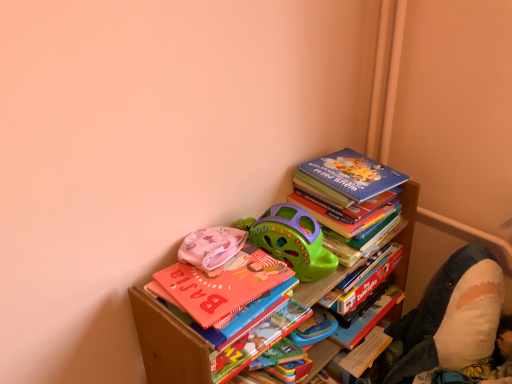
Question: Is green plastic toy car at upper center, positioned as the 2th toy in left-to-right order, behind multicolored paper at center, marked as the 2th paperback book in a right-to-left arrangement?

Choices:
 (A) yes
 (B) no

Answer: (B)

Question: Can you confirm if green plastic toy car at upper center, which is the second toy from right to left, is thinner than multicolored paper at center, acting as the second paperback book starting from the top?

Choices:
 (A) no
 (B) yes

Answer: (A)

Question: Is green plastic toy car at upper center, which is the second toy from right to left, directly adjacent to multicolored paper at center, acting as the second paperback book starting from the top?

Choices:
 (A) no
 (B) yes

Answer: (A)

Question: Can you confirm if green plastic toy car at upper center, positioned as the 2th toy in left-to-right order, is positioned to the left of multicolored paper at center, acting as the second paperback book starting from the top?

Choices:
 (A) no
 (B) yes

Answer: (A)

Question: Does green plastic toy car at upper center, which is the second toy from right to left, have a lesser height compared to multicolored paper at center, the first paperback book in the bottom-to-top sequence?

Choices:
 (A) yes
 (B) no

Answer: (B)

Question: Is blue matte book at upper right in front of or behind green plastic toy car at upper center, positioned as the 2th toy in left-to-right order, in the image?

Choices:
 (A) behind
 (B) front

Answer: (A)

Question: Visually, is blue matte book at upper right positioned to the left or to the right of green plastic toy car at upper center, which is the second toy from right to left?

Choices:
 (A) left
 (B) right

Answer: (B)

Question: Considering the positions of point (326, 155) and point (306, 279), is point (326, 155) closer or farther from the camera than point (306, 279)?

Choices:
 (A) closer
 (B) farther

Answer: (B)

Question: Considering the positions of blue matte book at upper right and green plastic toy car at upper center, which is the second toy from right to left, in the image, is blue matte book at upper right wider or thinner than green plastic toy car at upper center, which is the second toy from right to left,?

Choices:
 (A) thin
 (B) wide

Answer: (A)

Question: Is green plastic toy car at upper center, which is the second toy from right to left, inside or outside of blue matte book at upper right?

Choices:
 (A) inside
 (B) outside

Answer: (B)

Question: From the image's perspective, is green plastic toy car at upper center, positioned as the 2th toy in left-to-right order, located above or below blue matte book at upper right?

Choices:
 (A) above
 (B) below

Answer: (B)

Question: Considering the positions of green plastic toy car at upper center, which is the second toy from right to left, and blue matte book at upper right in the image, is green plastic toy car at upper center, which is the second toy from right to left, wider or thinner than blue matte book at upper right?

Choices:
 (A) thin
 (B) wide

Answer: (B)

Question: Would you say green plastic toy car at upper center, which is the second toy from right to left, is to the left or to the right of blue matte book at upper right in the picture?

Choices:
 (A) right
 (B) left

Answer: (B)

Question: Looking at the image, does multicolored paper at center, the first paperback book in the bottom-to-top sequence, seem bigger or smaller compared to soft plush shark at right, which is the third toy from left to right?

Choices:
 (A) big
 (B) small

Answer: (B)

Question: From a real-world perspective, relative to soft plush shark at right, which is the third toy from left to right, is multicolored paper at center, which is the 1th paperback book in left-to-right order, vertically above or below?

Choices:
 (A) below
 (B) above

Answer: (B)